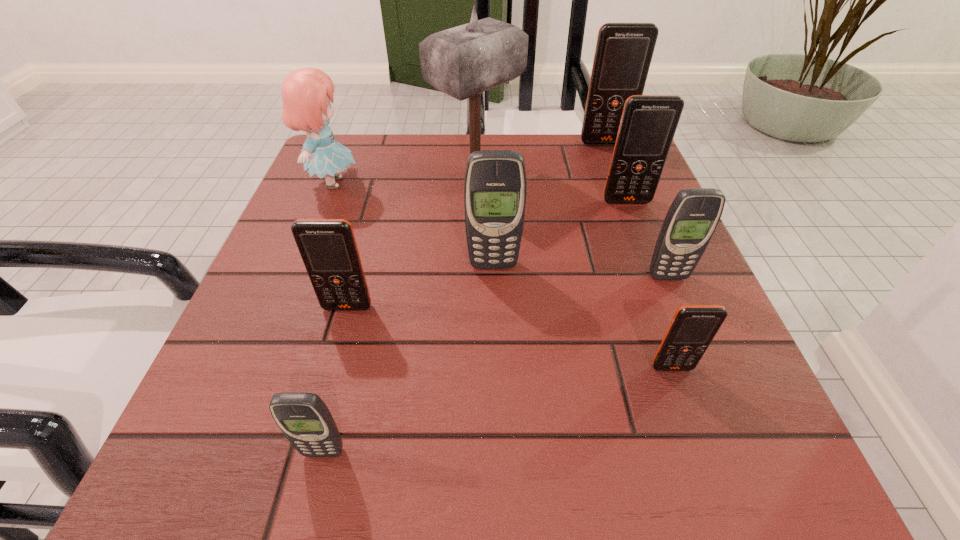
At what (x,y) coordinates should I click in order to perform the action: click on object at the far left corner. Please return your answer as a coordinate pair (x, y). Image resolution: width=960 pixels, height=540 pixels. Looking at the image, I should click on (306, 93).

Locate an element on the screen. object that is at the near left corner is located at coordinates pyautogui.click(x=305, y=420).

I want to click on object at the far right corner, so click(623, 54).

At what (x,y) coordinates should I click in order to perform the action: click on free region at the far edge of the desktop. Please return your answer as a coordinate pair (x, y). Looking at the image, I should click on (464, 189).

In the image, there is a desktop. Where is `vacant space at the near edge`? The width and height of the screenshot is (960, 540). vacant space at the near edge is located at coordinates (567, 435).

Image resolution: width=960 pixels, height=540 pixels. In order to click on vacant space at the left edge in this screenshot , I will do `click(291, 382)`.

Locate an element on the screen. The height and width of the screenshot is (540, 960). free space at the right edge of the desktop is located at coordinates (601, 203).

This screenshot has height=540, width=960. What are the coordinates of `vacant space at the far left corner of the desktop` in the screenshot? It's located at pyautogui.click(x=327, y=191).

In the image, there is a desktop. Where is `free space at the far right corner`? The image size is (960, 540). free space at the far right corner is located at coordinates (606, 157).

Find the location of a particular element. This screenshot has height=540, width=960. free space at the near right corner of the desktop is located at coordinates (783, 445).